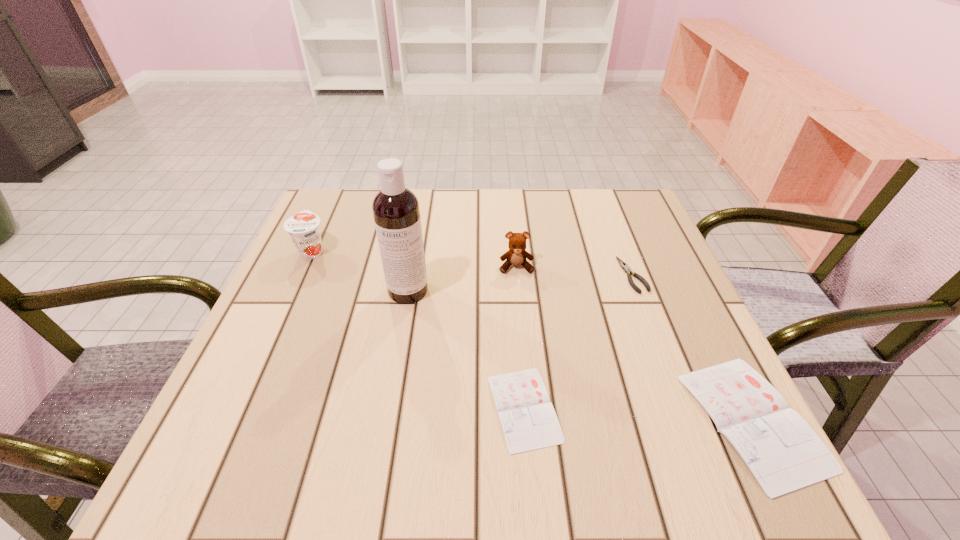
I want to click on free point that satisfies the following two spatial constraints: 1. on the front side of the right diary; 2. on the right side of the shorter diary, so click(525, 420).